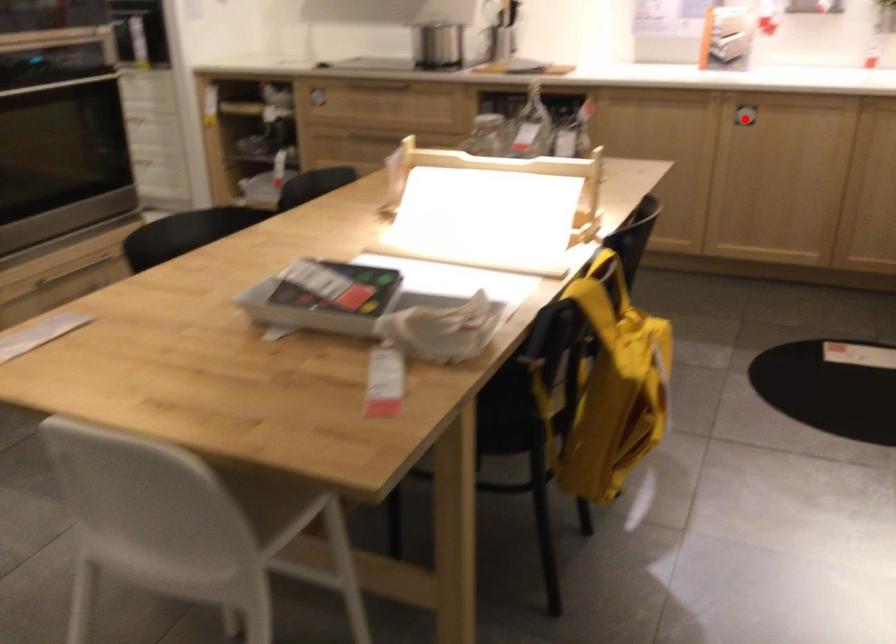
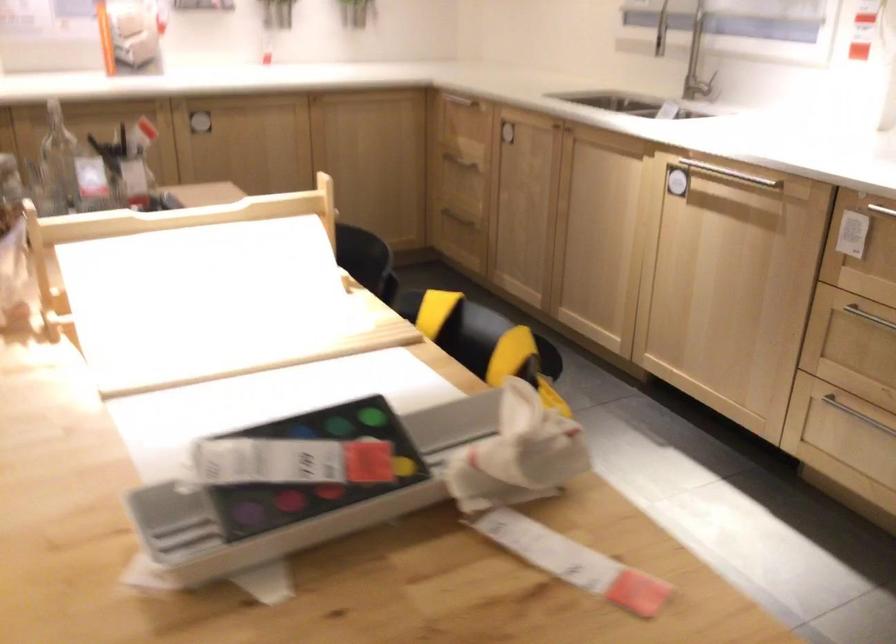
Question: I am providing you with two images of the same scene from different viewpoints. A red point is marked on the first image. Can you still see the location of the red point in image 2?

Choices:
 (A) Yes
 (B) No

Answer: (B)